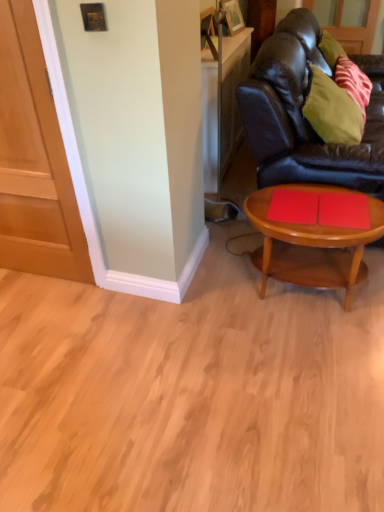
I want to click on free space in front of matte wood door at left, so click(39, 314).